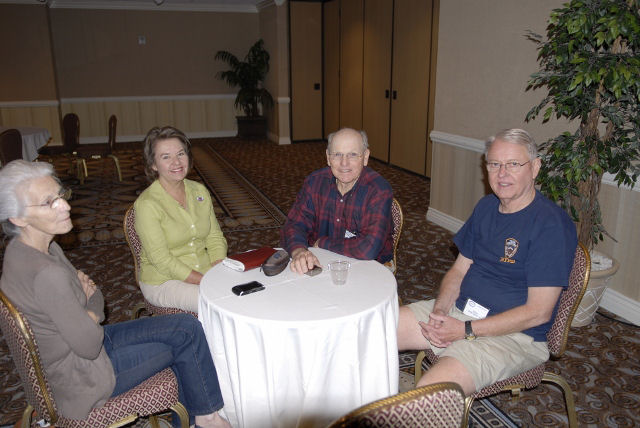
Identify the location of brown wall. (476, 106), (139, 72), (19, 81).